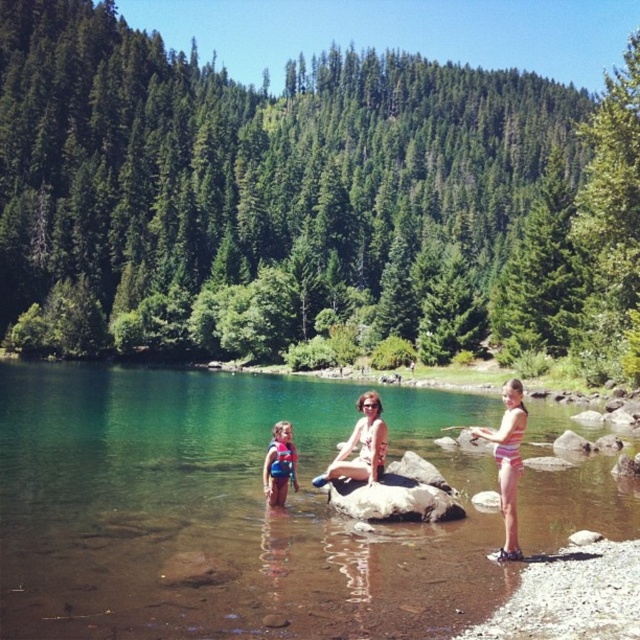
You are planning to take a photo of the clear water at center and the striped swimsuit at right. Which object should you focus on first if you want to capture both in one shot without moving the camera?

The clear water at center is larger in size than the striped swimsuit at right, so you should focus on the clear water at center first to ensure it fills the frame appropriately before adjusting for the smaller striped swimsuit at right.

You are a photographer taking a picture of the striped swimsuit at right and the matte white bikini at center. Based on their positions, which swimwear will appear larger in the photo?

The striped swimsuit at right appears larger in the photo because it is closer to the photographer than the matte white bikini at center.